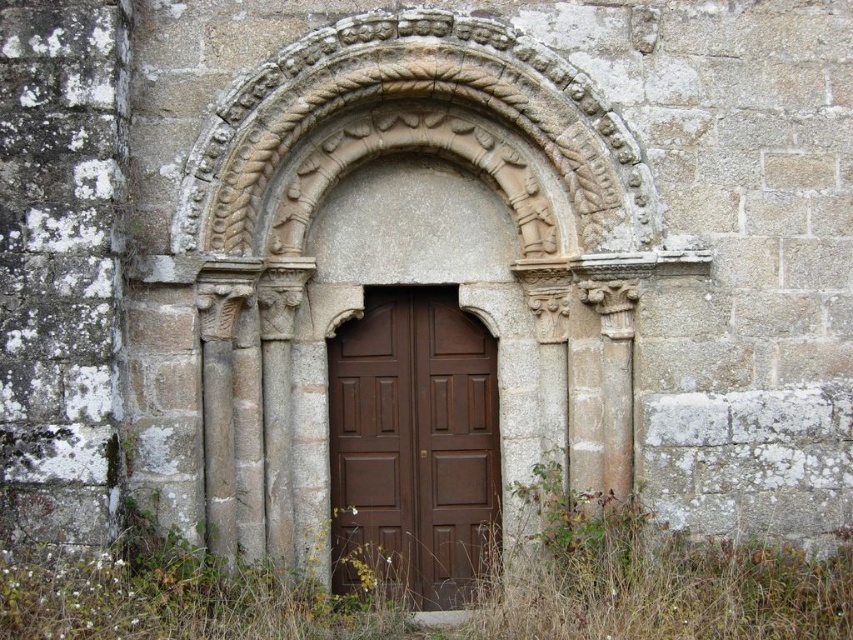
You are standing in front of the historical stone doorway and notice green grass at lower center and brown wooden door at center. Which object is positioned to the right of the other?

The green grass at lower center is to the right of the brown wooden door at center.

You are standing in front of the historical stone doorway and notice the green grass at lower center and the brown wooden door at center. Which object is positioned lower in the scene?

The green grass at lower center is positioned lower than the brown wooden door at center.

You are a delivery person with a box that is 4 feet wide. You need to deliver it through the doorway shown in the image. Can you fit the box through the space between the green grass at lower center and the brown wooden door at center?

The distance between the green grass at lower center and the brown wooden door at center is 4.12 feet, which is slightly wider than the 4 feet wide box. Therefore, the box should fit through the space.